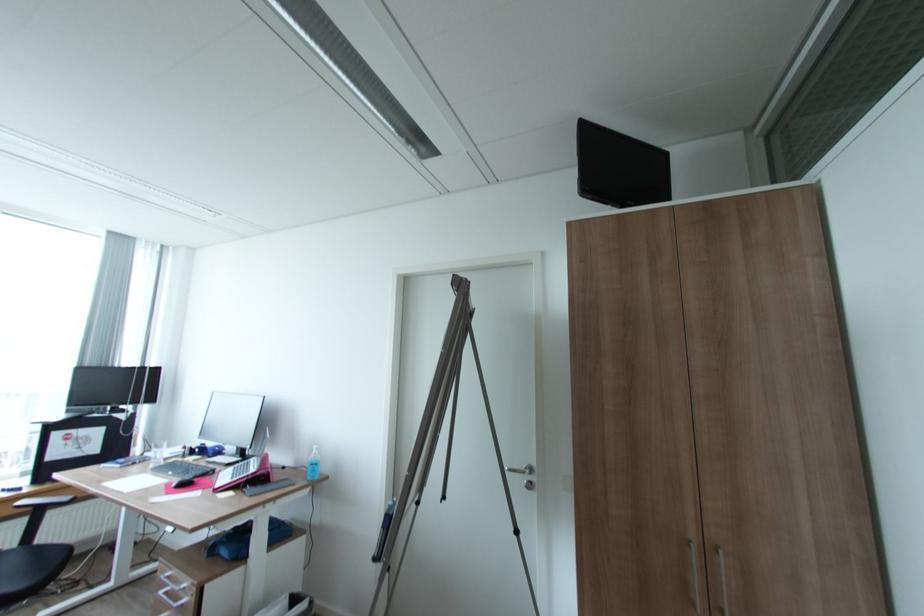
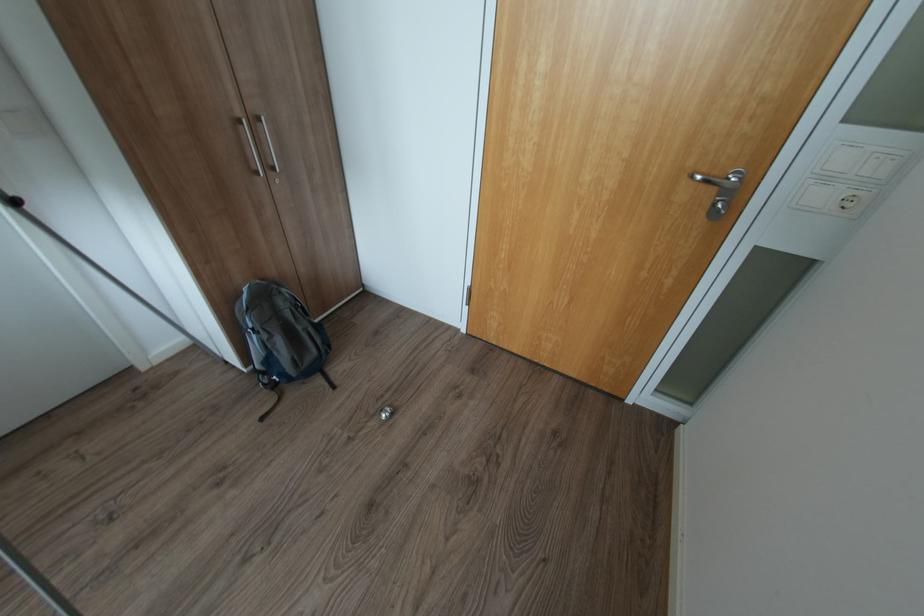
First-person continuous shooting, in which direction is the camera rotating?

The rotation direction of the camera is right-down.